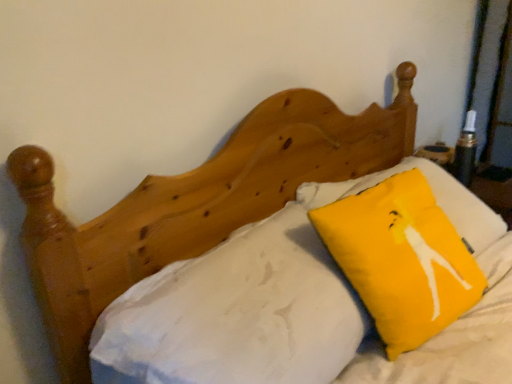
Question: Looking at their shapes, would you say yellow fabric pillow at upper right is wider or thinner than white cotton sheet at upper center?

Choices:
 (A) wide
 (B) thin

Answer: (B)

Question: Would you say yellow fabric pillow at upper right is to the left or to the right of white cotton sheet at upper center in the picture?

Choices:
 (A) right
 (B) left

Answer: (A)

Question: In the image, is yellow fabric pillow at upper right positioned in front of or behind white cotton sheet at upper center?

Choices:
 (A) behind
 (B) front

Answer: (A)

Question: From a real-world perspective, relative to yellow fabric pillow at upper right, is white cotton sheet at upper center vertically above or below?

Choices:
 (A) above
 (B) below

Answer: (B)

Question: Does point (303, 334) appear closer or farther from the camera than point (398, 294)?

Choices:
 (A) farther
 (B) closer

Answer: (B)

Question: Considering the positions of white cotton sheet at upper center and yellow fabric pillow at upper right in the image, is white cotton sheet at upper center wider or thinner than yellow fabric pillow at upper right?

Choices:
 (A) thin
 (B) wide

Answer: (B)

Question: Would you say white cotton sheet at upper center is to the left or to the right of yellow fabric pillow at upper right in the picture?

Choices:
 (A) right
 (B) left

Answer: (B)